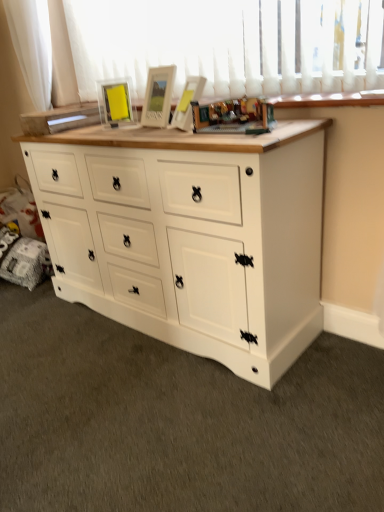
Question: Relative to wooden toy at center, is matte glass picture frame at upper center in front or behind?

Choices:
 (A) front
 (B) behind

Answer: (B)

Question: From a real-world perspective, is matte glass picture frame at upper center positioned above or below wooden toy at center?

Choices:
 (A) below
 (B) above

Answer: (B)

Question: Which object is the closest to the matte glass picture frame at upper center?

Choices:
 (A) wooden toy at center
 (B) white painted wood chest of drawers at center
 (C) white fabric curtain at upper left

Answer: (C)

Question: Based on their relative distances, which object is nearer to the white fabric curtain at upper left?

Choices:
 (A) white painted wood chest of drawers at center
 (B) matte glass picture frame at upper center
 (C) wooden toy at center

Answer: (B)